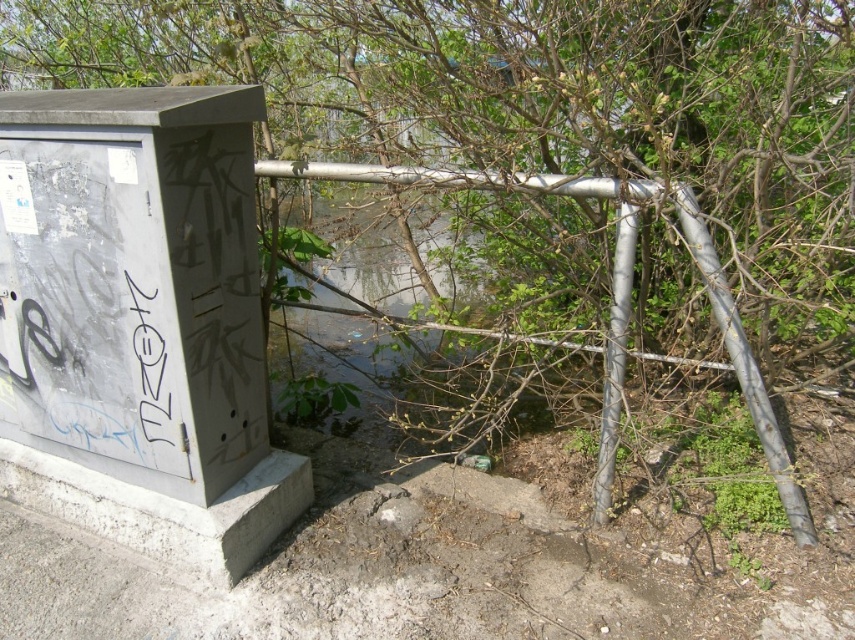
Question: Which point is closer to the camera?

Choices:
 (A) metallic gray pole at right
 (B) black graffiti at left
 (C) silver metallic pole at center-right
 (D) metallic silver rail at center

Answer: (B)

Question: Does metallic silver rail at center come behind black graffiti at left?

Choices:
 (A) no
 (B) yes

Answer: (B)

Question: Among these points, which one is farthest from the camera?

Choices:
 (A) (134, 353)
 (B) (746, 365)
 (C) (606, 342)

Answer: (C)

Question: Can you confirm if metallic gray pole at right is smaller than silver metallic pole at center-right?

Choices:
 (A) yes
 (B) no

Answer: (B)

Question: Is silver metallic pole at center-right smaller than black graffiti at left?

Choices:
 (A) no
 (B) yes

Answer: (A)

Question: Which point is closer to the camera taking this photo?

Choices:
 (A) (267, 168)
 (B) (753, 385)

Answer: (B)